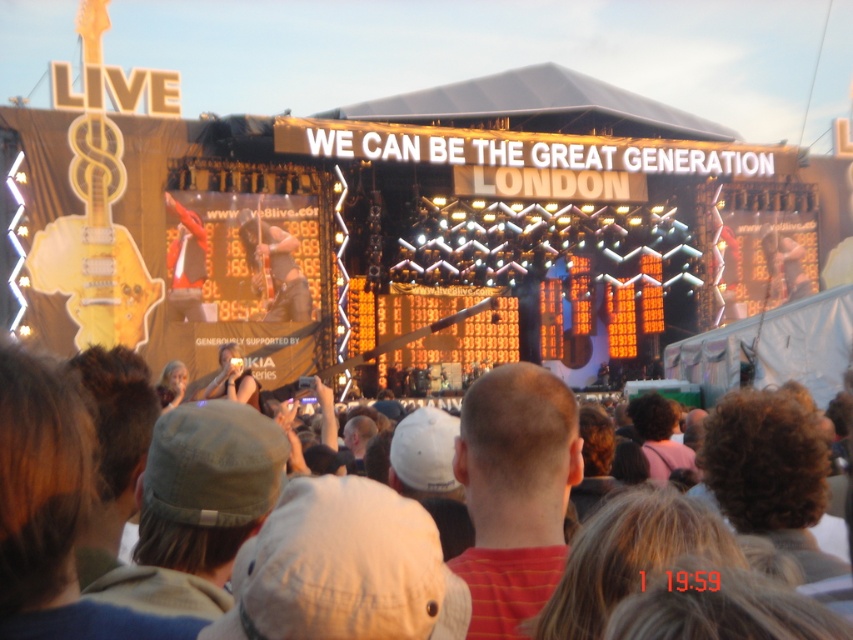
Question: Does white cotton hat at center have a smaller size compared to yellow matte guitar at upper left?

Choices:
 (A) yes
 (B) no

Answer: (A)

Question: Does red striped shirt at center appear under yellow matte guitar at upper left?

Choices:
 (A) yes
 (B) no

Answer: (A)

Question: Can you confirm if white cotton hat at center is wider than red striped shirt at center?

Choices:
 (A) no
 (B) yes

Answer: (B)

Question: Considering the real-world distances, which object is farthest from the red striped shirt at center?

Choices:
 (A) white cotton hat at center
 (B) yellow matte guitar at upper left

Answer: (B)

Question: Among these objects, which one is farthest from the camera?

Choices:
 (A) yellow matte guitar at upper left
 (B) white cotton hat at center

Answer: (A)

Question: Which point is closer to the camera taking this photo?

Choices:
 (A) (96, 211)
 (B) (99, 630)
 (C) (558, 451)

Answer: (B)